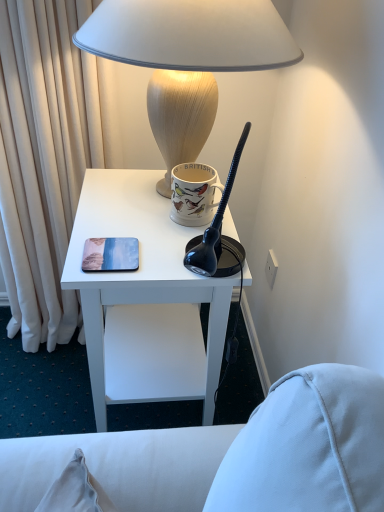
The width and height of the screenshot is (384, 512). Describe the element at coordinates (194, 194) in the screenshot. I see `matte ceramic mug at upper center` at that location.

The image size is (384, 512). What are the coordinates of `matte beige lamp at upper center` in the screenshot? It's located at (190, 34).

What do you see at coordinates (190, 34) in the screenshot?
I see `matte beige lamp at upper center` at bounding box center [190, 34].

You are a GUI agent. You are given a task and a screenshot of the screen. Output one action in this format:
    pyautogui.click(x=<x>, y=<y>)
    Task: Click on the matte plastic coaster at center left
    The height and width of the screenshot is (512, 384).
    Given the screenshot: What is the action you would take?
    pyautogui.click(x=110, y=254)

Looking at this image, considering the positions of objects matte ceramic mug at upper center and matte plastic coaster at center left in the image provided, who is behind, matte ceramic mug at upper center or matte plastic coaster at center left?

Positioned behind is matte ceramic mug at upper center.

Is matte ceramic mug at upper center bigger than matte plastic coaster at center left?

Indeed, matte ceramic mug at upper center has a larger size compared to matte plastic coaster at center left.

Is matte ceramic mug at upper center positioned beyond the bounds of matte plastic coaster at center left?

Yes, matte ceramic mug at upper center is outside of matte plastic coaster at center left.

Considering the relative positions of matte ceramic mug at upper center and matte plastic coaster at center left in the image provided, is matte ceramic mug at upper center to the left of matte plastic coaster at center left from the viewer's perspective?

In fact, matte ceramic mug at upper center is to the right of matte plastic coaster at center left.

From a real-world perspective, between matte beige lamp at upper center and matte plastic coaster at center left, who is vertically lower?

From a 3D spatial view, matte plastic coaster at center left is below.

Considering the relative sizes of matte beige lamp at upper center and matte plastic coaster at center left in the image provided, is matte beige lamp at upper center smaller than matte plastic coaster at center left?

No, matte beige lamp at upper center is not smaller than matte plastic coaster at center left.

Between point (151, 63) and point (113, 257), which one is positioned behind?

The point (113, 257) is farther.

From the image's perspective, is matte beige lamp at upper center on matte plastic coaster at center left?

Yes, from the image's perspective, matte beige lamp at upper center is on top of matte plastic coaster at center left.

Is white matte desk at center at the left side of matte plastic coaster at center left?

Incorrect, white matte desk at center is not on the left side of matte plastic coaster at center left.

Can you confirm if white matte desk at center is wider than matte plastic coaster at center left?

Yes.

Is white matte desk at center surrounding matte plastic coaster at center left?

Yes.

Who is smaller, white matte desk at center or matte plastic coaster at center left?

Smaller between the two is matte plastic coaster at center left.

Would you consider matte plastic coaster at center left to be distant from matte ceramic mug at upper center?

That's not correct — matte plastic coaster at center left is a little close to matte ceramic mug at upper center.

In the scene shown: Can you tell me how much matte plastic coaster at center left and matte ceramic mug at upper center differ in facing direction?

The angular difference between matte plastic coaster at center left and matte ceramic mug at upper center is 0.000195 degrees.

Looking at the image, does matte plastic coaster at center left seem bigger or smaller compared to matte ceramic mug at upper center?

matte plastic coaster at center left is smaller than matte ceramic mug at upper center.

In the image, is matte plastic coaster at center left positioned in front of or behind matte ceramic mug at upper center?

Visually, matte plastic coaster at center left is located in front of matte ceramic mug at upper center.

Measure the distance between white matte desk at center and matte beige lamp at upper center.

A distance of 17.79 inches exists between white matte desk at center and matte beige lamp at upper center.

From a real-world perspective, is white matte desk at center positioned above or below matte beige lamp at upper center?

In terms of real-world spatial position, white matte desk at center is below matte beige lamp at upper center.

Is white matte desk at center facing away from matte beige lamp at upper center?

white matte desk at center is not turned away from matte beige lamp at upper center.

Which of these two, white matte desk at center or matte beige lamp at upper center, is wider?

matte beige lamp at upper center is wider.

Could you tell me if matte ceramic mug at upper center is facing white matte desk at center?

No, matte ceramic mug at upper center is not turned towards white matte desk at center.

From the picture: Which of these two, matte ceramic mug at upper center or white matte desk at center, is thinner?

Thinner between the two is matte ceramic mug at upper center.

Which object is positioned more to the right, matte ceramic mug at upper center or white matte desk at center?

Positioned to the right is matte ceramic mug at upper center.

From a real-world perspective, does matte ceramic mug at upper center stand above white matte desk at center?

Yes, from a real-world perspective, matte ceramic mug at upper center is on top of white matte desk at center.

Is the depth of matte beige lamp at upper center less than that of matte ceramic mug at upper center?

Yes.

From the image's perspective, which object appears higher, matte beige lamp at upper center or matte ceramic mug at upper center?

matte beige lamp at upper center appears higher in the image.

Which is more to the left, matte beige lamp at upper center or matte ceramic mug at upper center?

From the viewer's perspective, matte beige lamp at upper center appears more on the left side.

In terms of height, does matte beige lamp at upper center look taller or shorter compared to matte ceramic mug at upper center?

matte beige lamp at upper center is taller than matte ceramic mug at upper center.

At what (x,y) coordinates should I click in order to perform the action: click on pad that appears in front of the matte ceramic mug at upper center. Please return your answer as a coordinate pair (x, y). The width and height of the screenshot is (384, 512). Looking at the image, I should click on (110, 254).

In the image, there is a matte plastic coaster at center left. Where is `lamp above it (from the image's perspective)`? lamp above it (from the image's perspective) is located at coordinates pos(190,34).

From the image, which object appears to be farther from white matte desk at center, matte plastic coaster at center left or matte ceramic mug at upper center?

matte ceramic mug at upper center is further to white matte desk at center.

Based on their spatial positions, is matte ceramic mug at upper center or matte plastic coaster at center left closer to white matte desk at center?

Among the two, matte plastic coaster at center left is located nearer to white matte desk at center.

Estimate the real-world distances between objects in this image. Which object is further from matte plastic coaster at center left, matte ceramic mug at upper center or white matte desk at center?

Among the two, white matte desk at center is located further to matte plastic coaster at center left.

When comparing their distances from matte ceramic mug at upper center, does matte beige lamp at upper center or white matte desk at center seem closer?

white matte desk at center is closer to matte ceramic mug at upper center.

Based on their spatial positions, is matte plastic coaster at center left or matte beige lamp at upper center closer to matte ceramic mug at upper center?

matte plastic coaster at center left is closer to matte ceramic mug at upper center.

From the image, which object appears to be nearer to matte ceramic mug at upper center, matte beige lamp at upper center or matte plastic coaster at center left?

matte plastic coaster at center left is positioned closer to the anchor matte ceramic mug at upper center.

Estimate the real-world distances between objects in this image. Which object is further from matte plastic coaster at center left, white matte desk at center or matte ceramic mug at upper center?

The object further to matte plastic coaster at center left is white matte desk at center.

Which object lies further to the anchor point matte beige lamp at upper center, matte ceramic mug at upper center or white matte desk at center?

white matte desk at center lies further to matte beige lamp at upper center than the other object.

The image size is (384, 512). What are the coordinates of `coffee cup that lies between matte beige lamp at upper center and matte plastic coaster at center left from top to bottom` in the screenshot? It's located at (194, 194).

Locate an element on the screen. pad between matte beige lamp at upper center and white matte desk at center in the vertical direction is located at coordinates (110, 254).

Locate an element on the screen. coffee cup between matte beige lamp at upper center and white matte desk at center vertically is located at coordinates (194, 194).

Image resolution: width=384 pixels, height=512 pixels. What are the coordinates of `pad between matte ceramic mug at upper center and white matte desk at center in the vertical direction` in the screenshot? It's located at (110, 254).